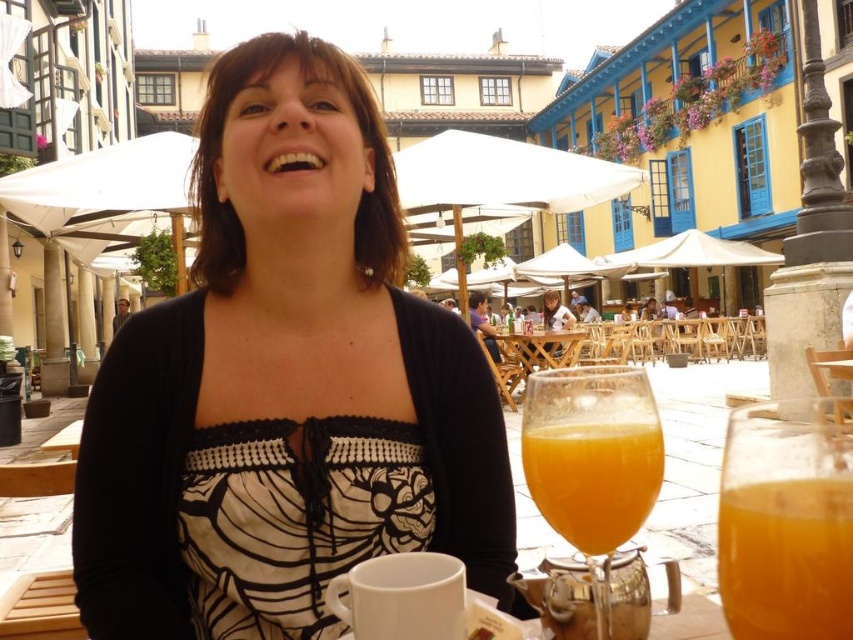
You are a customer at this outdoor cafe and want to place your phone on the matte black top at center or the wooden table at center. Which surface can accommodate a phone that is 1.5 centimeters thick?

The wooden table at center is thicker than the matte black top at center, so the wooden table at center can accommodate the phone since it has more surface depth.

You are a customer at the outdoor patio and want to reach for the translucent glass at lower center. Considering the coordinates provided in the Objects Description, can you confirm if the glass is positioned closer to the edge of the table compared to the center?

The translucent glass at lower center is located at point (593, 480), which indicates it is positioned closer to the edge of the table rather than the center.

You are standing at the edge of the patio looking towards the woman in the scene. There is a point marked at coordinates (283, 385). What object is located at this point?

The point at coordinates (283, 385) corresponds to the matte black top at center.